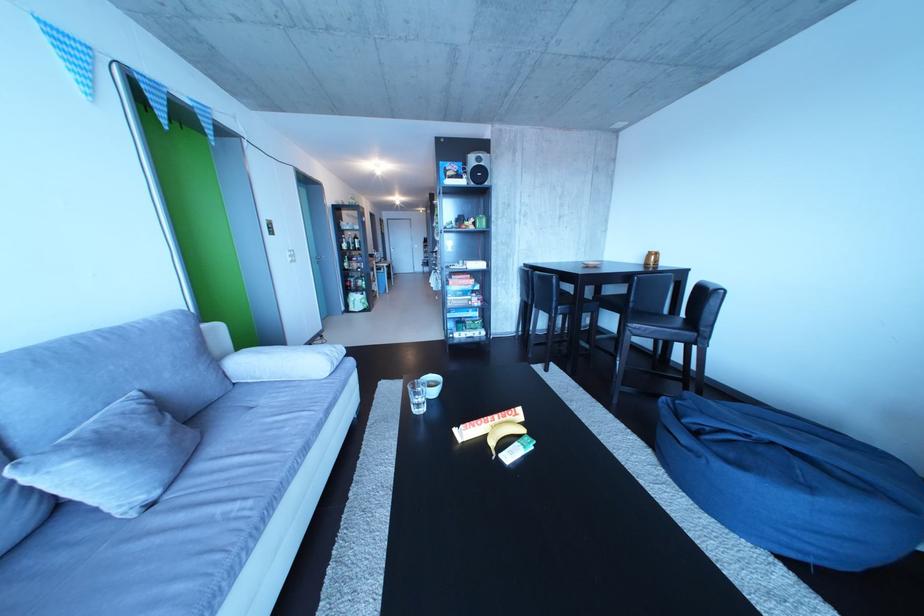
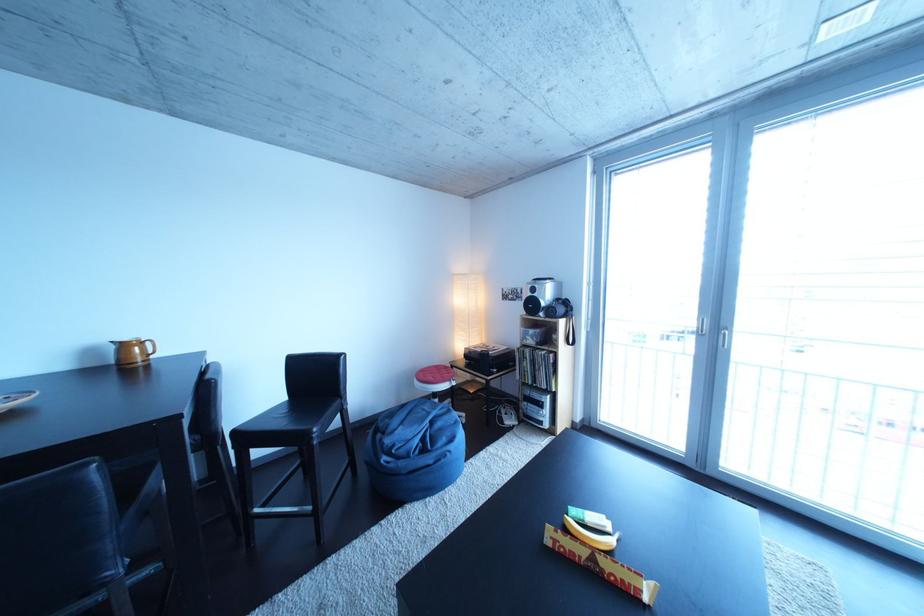
Find the pixel in the second image that matches (x=663, y=259) in the first image.

(138, 351)